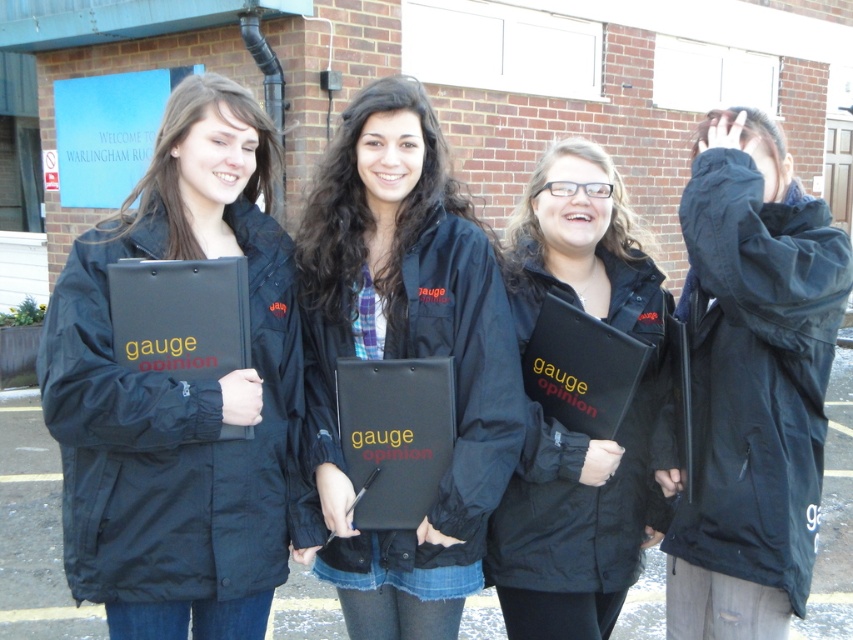
Question: Which is nearer to the black matte jacket at right?

Choices:
 (A) matte black clipboard at left
 (B) matte black folder at center
 (C) black matte jacket at center

Answer: (B)

Question: Which point is farther from the camera taking this photo?

Choices:
 (A) (724, 465)
 (B) (515, 547)

Answer: (B)

Question: Does black matte jacket at center have a greater width compared to black matte jacket at right?

Choices:
 (A) no
 (B) yes

Answer: (B)

Question: Which object is positioned closest to the matte black folder at center?

Choices:
 (A) black matte jacket at center
 (B) black matte jacket at right

Answer: (B)

Question: Does matte black clipboard at left lie behind matte black folder at center?

Choices:
 (A) no
 (B) yes

Answer: (A)

Question: Can you confirm if matte black clipboard at left is positioned to the left of matte black folder at center?

Choices:
 (A) no
 (B) yes

Answer: (B)